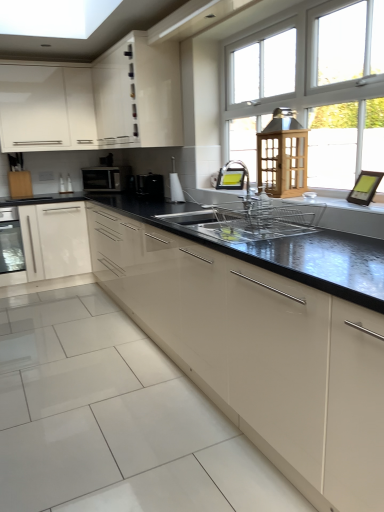
Describe the element at coordinates (105, 178) in the screenshot. I see `satin black microwave at upper left` at that location.

This screenshot has height=512, width=384. In order to click on glossy cream cabinet at center, which ranks as the 1th cabinetry in bottom-to-top order in this screenshot , I will do (x=259, y=353).

Measure the distance between point (158, 180) and camera.

3.55 meters.

Locate an element on the screen. Image resolution: width=384 pixels, height=512 pixels. white glossy paper towel holder at center, the 1th appliance from the right is located at coordinates (175, 185).

From a real-world perspective, is white glossy paper towel holder at center, the 1th appliance from the right, physically below satin nickel faucet at center, which is the 2th faucet in back-to-front order?

No, from a real-world perspective, white glossy paper towel holder at center, the 1th appliance from the right, is not under satin nickel faucet at center, which is the 2th faucet in back-to-front order.

Based on their sizes in the image, would you say white glossy paper towel holder at center, the 1th appliance from the right, is bigger or smaller than satin nickel faucet at center, which is the 2th faucet in back-to-front order?

In the image, white glossy paper towel holder at center, the 1th appliance from the right, appears to be smaller than satin nickel faucet at center, which is the 2th faucet in back-to-front order.

From the white glossy paper towel holder at center, the 1th appliance from the right, count 1st faucet to the right and point to it. Please provide its 2D coordinates.

[(236, 182)]

Which is more to the left, white glossy paper towel holder at center, positioned as the 2th appliance in back-to-front order, or satin nickel faucet at center, which is the 2th faucet in back-to-front order?

From the viewer's perspective, white glossy paper towel holder at center, positioned as the 2th appliance in back-to-front order, appears more on the left side.

From a real-world perspective, relative to black plastic toaster at center, acting as the 1th appliance starting from the back, is white glossy paper towel holder at center, positioned as the 2th appliance in back-to-front order, vertically above or below?

In terms of real-world spatial position, white glossy paper towel holder at center, positioned as the 2th appliance in back-to-front order, is above black plastic toaster at center, acting as the 1th appliance starting from the back.

Is white glossy paper towel holder at center, placed as the first appliance when sorted from front to back, located outside black plastic toaster at center, acting as the 1th appliance starting from the back?

Yes, white glossy paper towel holder at center, placed as the first appliance when sorted from front to back, is outside of black plastic toaster at center, acting as the 1th appliance starting from the back.

Considering the relative sizes of white glossy paper towel holder at center, placed as the first appliance when sorted from front to back, and black plastic toaster at center, which is the 1th appliance in left-to-right order, in the image provided, is white glossy paper towel holder at center, placed as the first appliance when sorted from front to back, wider than black plastic toaster at center, which is the 1th appliance in left-to-right order,?

No.

Does white glossy paper towel holder at center, positioned as the 2th appliance in back-to-front order, have a lesser height compared to black plastic toaster at center, which is the 1th appliance in left-to-right order?

In fact, white glossy paper towel holder at center, positioned as the 2th appliance in back-to-front order, may be taller than black plastic toaster at center, which is the 1th appliance in left-to-right order.

Locate an element on the screen. Image resolution: width=384 pixels, height=512 pixels. faucet that is the 2nd one when counting downward from the white glossy cabinet at upper left, the 4th cabinetry when ordered from bottom to top (from the image's perspective) is located at coordinates (236, 182).

Is satin nickel faucet at center, which is the 2th faucet in back-to-front order, inside white glossy cabinet at upper left, the 4th cabinetry when ordered from bottom to top?

Definitely not — satin nickel faucet at center, which is the 2th faucet in back-to-front order, is not inside white glossy cabinet at upper left, the 4th cabinetry when ordered from bottom to top.

Is white glossy cabinet at upper left, the 4th cabinetry when ordered from bottom to top, to the left of satin nickel faucet at center, positioned as the first faucet in front-to-back order, from the viewer's perspective?

Yes, white glossy cabinet at upper left, the 4th cabinetry when ordered from bottom to top, is to the left of satin nickel faucet at center, positioned as the first faucet in front-to-back order.

Is white glossy cabinet at upper left, arranged as the first cabinetry when viewed from the top, wider than satin nickel faucet at center, which is the 2th faucet in back-to-front order?

Yes.

Is glossy cream cabinet at center, which ranks as the 1th cabinetry in bottom-to-top order, next to wooden cutting board at left, which is the third cabinetry from top to bottom?

glossy cream cabinet at center, which ranks as the 1th cabinetry in bottom-to-top order, is not next to wooden cutting board at left, which is the third cabinetry from top to bottom, and they're not touching.

Considering the sizes of objects glossy cream cabinet at center, which ranks as the 1th cabinetry in bottom-to-top order, and wooden cutting board at left, which is the third cabinetry from top to bottom, in the image provided, who is smaller, glossy cream cabinet at center, which ranks as the 1th cabinetry in bottom-to-top order, or wooden cutting board at left, which is the third cabinetry from top to bottom,?

wooden cutting board at left, which is the third cabinetry from top to bottom.

From the image's perspective, is glossy cream cabinet at center, the 4th cabinetry viewed from the top, located beneath wooden cutting board at left, arranged as the 2th cabinetry when ordered from the bottom?

Yes.

Which object is positioned more to the left, glossy cream cabinet at center, which ranks as the 1th cabinetry in bottom-to-top order, or wooden cutting board at left, which is the third cabinetry from top to bottom?

Positioned to the left is wooden cutting board at left, which is the third cabinetry from top to bottom.

From a real-world perspective, is satin nickel faucet at center, which is the 2th faucet in back-to-front order, physically located above or below white glossy cabinet at upper center, the 2th cabinetry when ordered from top to bottom?

In terms of real-world spatial position, satin nickel faucet at center, which is the 2th faucet in back-to-front order, is below white glossy cabinet at upper center, the 2th cabinetry when ordered from top to bottom.

Can we say satin nickel faucet at center, positioned as the first faucet in front-to-back order, lies outside white glossy cabinet at upper center, the third cabinetry positioned from the bottom?

satin nickel faucet at center, positioned as the first faucet in front-to-back order, is positioned outside white glossy cabinet at upper center, the third cabinetry positioned from the bottom.

How many degrees apart are the facing directions of satin nickel faucet at center, which is the 2th faucet in back-to-front order, and white glossy cabinet at upper center, the 2th cabinetry when ordered from top to bottom?

The facing directions of satin nickel faucet at center, which is the 2th faucet in back-to-front order, and white glossy cabinet at upper center, the 2th cabinetry when ordered from top to bottom, are 0.733 degrees apart.

In the scene shown: Looking at the image, does satin nickel faucet at center, positioned as the first faucet in front-to-back order, seem bigger or smaller compared to white glossy cabinet at upper center, the third cabinetry positioned from the bottom?

In the image, satin nickel faucet at center, positioned as the first faucet in front-to-back order, appears to be smaller than white glossy cabinet at upper center, the third cabinetry positioned from the bottom.

Is glossy cream cabinet at center, which ranks as the 1th cabinetry in bottom-to-top order, facing towards satin nickel faucet at center, positioned as the first faucet in front-to-back order?

No, glossy cream cabinet at center, which ranks as the 1th cabinetry in bottom-to-top order, does not turn towards satin nickel faucet at center, positioned as the first faucet in front-to-back order.

Are glossy cream cabinet at center, the 4th cabinetry viewed from the top, and satin nickel faucet at center, positioned as the first faucet in front-to-back order, beside each other?

No, glossy cream cabinet at center, the 4th cabinetry viewed from the top, is not with satin nickel faucet at center, positioned as the first faucet in front-to-back order.

Identify the location of faucet that is the 1st object located above the glossy cream cabinet at center, the 4th cabinetry viewed from the top (from the image's perspective). This screenshot has height=512, width=384. (236, 182).

Is white glossy cabinet at upper center, the third cabinetry positioned from the bottom, at the left side of white glossy cabinet at upper left, the 4th cabinetry when ordered from bottom to top?

No.

Based on the photo, from a real-world perspective, which object stands above the other?

white glossy cabinet at upper center, the 2th cabinetry when ordered from top to bottom, from a real-world perspective.

Is white glossy cabinet at upper center, the 2th cabinetry when ordered from top to bottom, far from white glossy cabinet at upper left, arranged as the first cabinetry when viewed from the top?

No, there isn't a large distance between white glossy cabinet at upper center, the 2th cabinetry when ordered from top to bottom, and white glossy cabinet at upper left, arranged as the first cabinetry when viewed from the top.

Does white glossy cabinet at upper center, the third cabinetry positioned from the bottom, turn towards white glossy cabinet at upper left, the 4th cabinetry when ordered from bottom to top?

Yes, white glossy cabinet at upper center, the third cabinetry positioned from the bottom, is aimed at white glossy cabinet at upper left, the 4th cabinetry when ordered from bottom to top.

Where is `the 1st appliance behind the satin nickel faucet at center, positioned as the first faucet in front-to-back order, counting from the anchor's position`? The image size is (384, 512). the 1st appliance behind the satin nickel faucet at center, positioned as the first faucet in front-to-back order, counting from the anchor's position is located at coordinates (175, 185).

At what (x,y) coordinates should I click in order to perform the action: click on appliance located in front of the black plastic toaster at center, acting as the 1th appliance starting from the back. Please return your answer as a coordinate pair (x, y). Image resolution: width=384 pixels, height=512 pixels. Looking at the image, I should click on (175, 185).

From the image, which object appears to be farther from white glossy cabinet at upper left, arranged as the first cabinetry when viewed from the top, white glossy paper towel holder at center, positioned as the 2th appliance in back-to-front order, or white glossy cabinet at upper center, the third cabinetry positioned from the bottom?

Among the two, white glossy paper towel holder at center, positioned as the 2th appliance in back-to-front order, is located further to white glossy cabinet at upper left, arranged as the first cabinetry when viewed from the top.

Based on their spatial positions, is white glossy cabinet at upper left, arranged as the first cabinetry when viewed from the top, or satin black microwave at upper left further from white glossy paper towel holder at center, placed as the first appliance when sorted from front to back?

The object further to white glossy paper towel holder at center, placed as the first appliance when sorted from front to back, is white glossy cabinet at upper left, arranged as the first cabinetry when viewed from the top.

Estimate the real-world distances between objects in this image. Which object is closer to glossy cream cabinet at center, which ranks as the 1th cabinetry in bottom-to-top order, black plastic toaster at center, acting as the 1th appliance starting from the back, or wooden cutting board at left, which is the third cabinetry from top to bottom?

Based on the image, black plastic toaster at center, acting as the 1th appliance starting from the back, appears to be nearer to glossy cream cabinet at center, which ranks as the 1th cabinetry in bottom-to-top order.

Considering their positions, is black plastic toaster at center, placed as the 2th appliance when sorted from right to left, positioned closer to white glossy paper towel holder at center, marked as the 2th appliance in a left-to-right arrangement, than white glossy cabinet at upper left, arranged as the first cabinetry when viewed from the top?

black plastic toaster at center, placed as the 2th appliance when sorted from right to left.

Based on their spatial positions, is white glossy paper towel holder at center, the 1th appliance from the right, or satin black microwave at upper left further from white glossy cabinet at upper left, arranged as the first cabinetry when viewed from the top?

white glossy paper towel holder at center, the 1th appliance from the right.

From the image, which object appears to be nearer to satin nickel faucet at center, positioned as the first faucet in front-to-back order, wooden cutting board at left, which is the third cabinetry from top to bottom, or satin black microwave at upper left?

The object closer to satin nickel faucet at center, positioned as the first faucet in front-to-back order, is satin black microwave at upper left.

Considering their positions, is satin nickel faucet at center, which is the 2th faucet in back-to-front order, positioned closer to wooden cutting board at left, arranged as the 2th cabinetry when ordered from the bottom, than black plastic toaster at center, placed as the 2th appliance when sorted from right to left?

Among the two, black plastic toaster at center, placed as the 2th appliance when sorted from right to left, is located nearer to wooden cutting board at left, arranged as the 2th cabinetry when ordered from the bottom.

From the image, which object appears to be nearer to satin black microwave at upper left, matte glass oven at left or glossy cream cabinet at center, the 4th cabinetry viewed from the top?

Based on the image, matte glass oven at left appears to be nearer to satin black microwave at upper left.

The image size is (384, 512). In order to click on kitchen appliance between white glossy cabinet at upper left, the 4th cabinetry when ordered from bottom to top, and satin nickel faucet at center, placed as the 2th faucet when sorted from front to back, in the horizontal direction in this screenshot , I will do `click(105, 178)`.

Find the location of `home appliance located between glossy cream cabinet at center, which ranks as the 1th cabinetry in bottom-to-top order, and satin black microwave at upper left in the depth direction`. home appliance located between glossy cream cabinet at center, which ranks as the 1th cabinetry in bottom-to-top order, and satin black microwave at upper left in the depth direction is located at coordinates (11, 248).

Where is `cabinetry between wooden cutting board at left, which is the third cabinetry from top to bottom, and satin black microwave at upper left`? cabinetry between wooden cutting board at left, which is the third cabinetry from top to bottom, and satin black microwave at upper left is located at coordinates (46, 108).

Where is `faucet located between white glossy cabinet at upper left, arranged as the first cabinetry when viewed from the top, and satin nickel faucet at center, marked as the first faucet in a back-to-front arrangement, in the left-right direction`? The image size is (384, 512). faucet located between white glossy cabinet at upper left, arranged as the first cabinetry when viewed from the top, and satin nickel faucet at center, marked as the first faucet in a back-to-front arrangement, in the left-right direction is located at coordinates tap(236, 182).